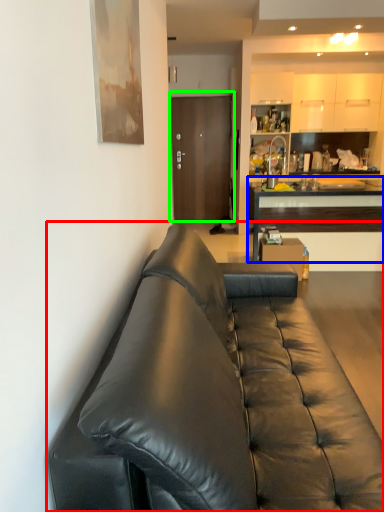
Question: Which object is positioned farthest from studio couch (highlighted by a red box)? Select from cabinetry (highlighted by a blue box) and door (highlighted by a green box).

Choices:
 (A) cabinetry
 (B) door

Answer: (B)